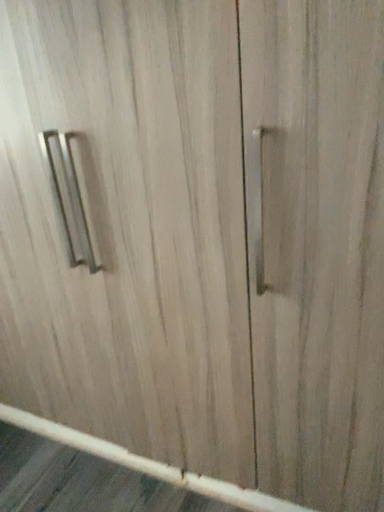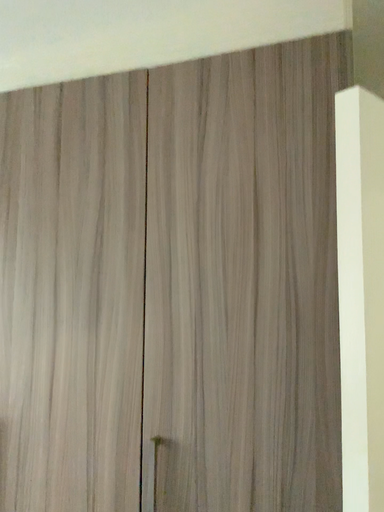
Question: Which way did the camera rotate in the video?

Choices:
 (A) rotated upward
 (B) rotated downward

Answer: (A)